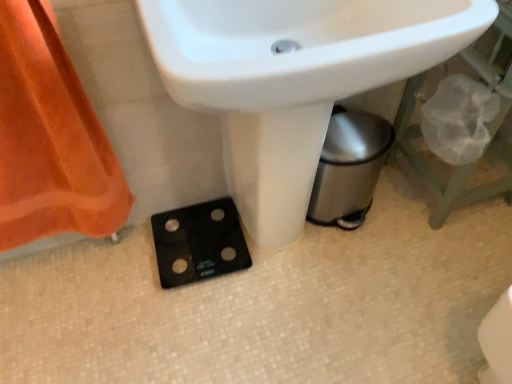
This screenshot has width=512, height=384. Identify the location of vacant space to the right of orange fabric at left. (155, 289).